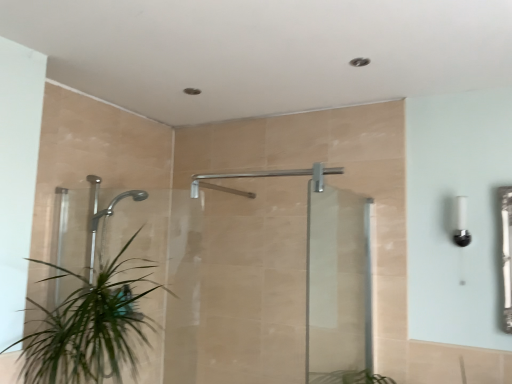
Question: Can you confirm if transparent glass screen door at center, arranged as the first screen door when viewed from the right, is shorter than green leafy plant at lower left?

Choices:
 (A) no
 (B) yes

Answer: (A)

Question: Can you confirm if transparent glass screen door at center, acting as the 2th screen door starting from the left, is smaller than green leafy plant at lower left?

Choices:
 (A) no
 (B) yes

Answer: (B)

Question: Is transparent glass screen door at center, arranged as the first screen door when viewed from the right, not near green leafy plant at lower left?

Choices:
 (A) yes
 (B) no

Answer: (A)

Question: Is transparent glass screen door at center, arranged as the first screen door when viewed from the right, outside green leafy plant at lower left?

Choices:
 (A) no
 (B) yes

Answer: (B)

Question: Is transparent glass screen door at center, arranged as the first screen door when viewed from the right, closer to camera compared to green leafy plant at lower left?

Choices:
 (A) yes
 (B) no

Answer: (B)

Question: Is transparent glass screen door at center, acting as the 2th screen door starting from the left, aimed at green leafy plant at lower left?

Choices:
 (A) no
 (B) yes

Answer: (A)

Question: Is silver metallic shower at center not within transparent glass shower door at center, the first screen door from the left?

Choices:
 (A) no
 (B) yes

Answer: (B)

Question: Can you confirm if silver metallic shower at center is positioned to the right of transparent glass shower door at center, the first screen door from the left?

Choices:
 (A) yes
 (B) no

Answer: (A)

Question: Is silver metallic shower at center taller than transparent glass shower door at center, which ranks as the 2th screen door in right-to-left order?

Choices:
 (A) no
 (B) yes

Answer: (A)

Question: Is silver metallic shower at center beside transparent glass shower door at center, which ranks as the 2th screen door in right-to-left order?

Choices:
 (A) no
 (B) yes

Answer: (A)

Question: Is the position of silver metallic shower at center more distant than that of transparent glass shower door at center, which ranks as the 2th screen door in right-to-left order?

Choices:
 (A) yes
 (B) no

Answer: (A)

Question: Is transparent glass shower door at center, the first screen door from the left, at the back of silver metallic shower at center?

Choices:
 (A) yes
 (B) no

Answer: (B)

Question: Considering the relative positions of silver metallic shower at center and green leafy plant at lower left in the image provided, is silver metallic shower at center behind green leafy plant at lower left?

Choices:
 (A) yes
 (B) no

Answer: (A)